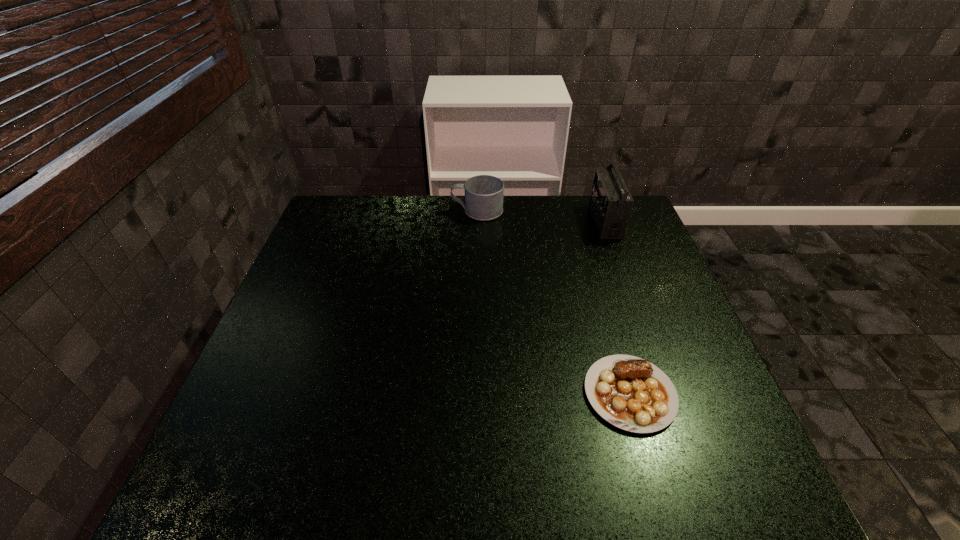
Locate an element on the screen. free space between the radio receiver and the shortest object is located at coordinates (617, 307).

Find the location of a particular element. vacant area between the second shortest object and the shortest object is located at coordinates (554, 302).

At what (x,y) coordinates should I click in order to perform the action: click on free spot between the steak and the tallest object. Please return your answer as a coordinate pair (x, y). The height and width of the screenshot is (540, 960). Looking at the image, I should click on (617, 307).

This screenshot has width=960, height=540. I want to click on object that ranks as the closest to the nearest object, so click(x=611, y=203).

Point out which object is positioned as the nearest to the nearest object. Please provide its 2D coordinates. Your answer should be formatted as a tuple, i.e. [(x, y)], where the tuple contains the x and y coordinates of a point satisfying the conditions above.

[(611, 203)]

Locate an element on the screen. vacant region that satisfies the following two spatial constraints: 1. on the front panel of the radio receiver; 2. on the front side of the nearest object is located at coordinates (668, 394).

This screenshot has height=540, width=960. Identify the location of free space that satisfies the following two spatial constraints: 1. on the side of the nearest object with the handle; 2. on the left side of the leftmost object. (476, 394).

At what (x,y) coordinates should I click in order to perform the action: click on vacant space that satisfies the following two spatial constraints: 1. on the side of the nearest object with the handle; 2. on the right side of the mug. Please return your answer as a coordinate pair (x, y). This screenshot has height=540, width=960. Looking at the image, I should click on (476, 394).

At what (x,y) coordinates should I click in order to perform the action: click on free spot that satisfies the following two spatial constraints: 1. on the side of the steak with the handle; 2. on the left side of the mug. Please return your answer as a coordinate pair (x, y). Looking at the image, I should click on (476, 394).

Locate an element on the screen. free space that satisfies the following two spatial constraints: 1. on the side of the steak with the handle; 2. on the right side of the leftmost object is located at coordinates (476, 394).